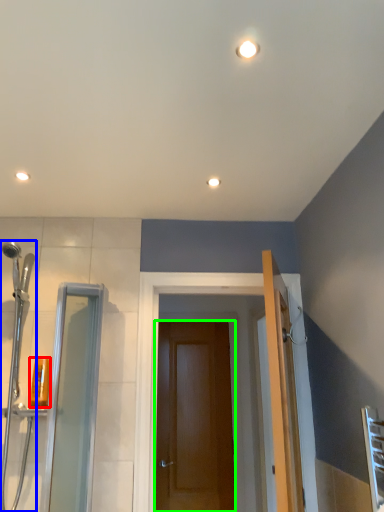
Question: Which object is positioned closest to toiletry (highlighted by a red box)? Select from shower door (highlighted by a blue box) and door (highlighted by a green box).

Choices:
 (A) shower door
 (B) door

Answer: (A)